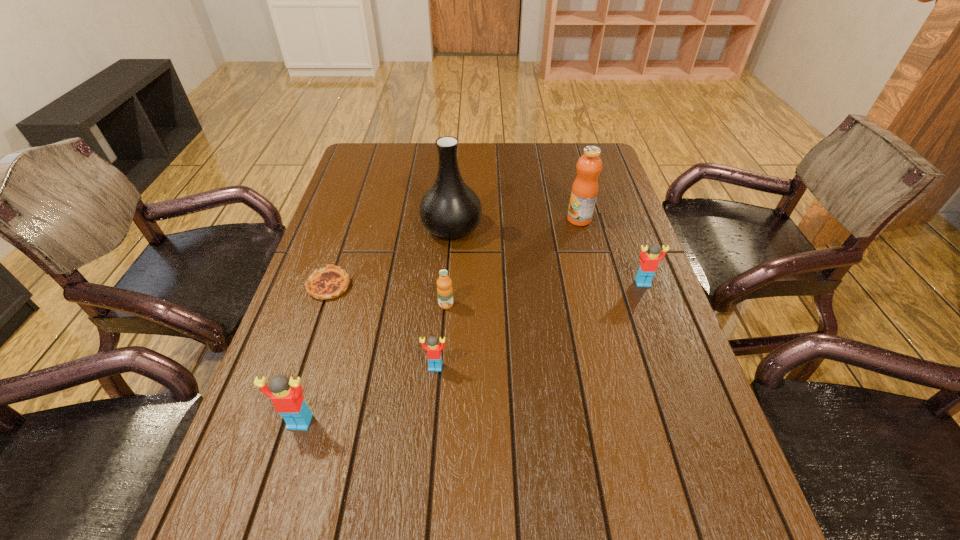
If equal spacing is the goal by inserting an additional Lego among them, please point out a vacant space for this new Lego. Please provide its 2D coordinates. Your answer should be formatted as a tuple, i.e. [(x, y)], where the tuple contains the x and y coordinates of a point satisfying the conditions above.

[(548, 321)]